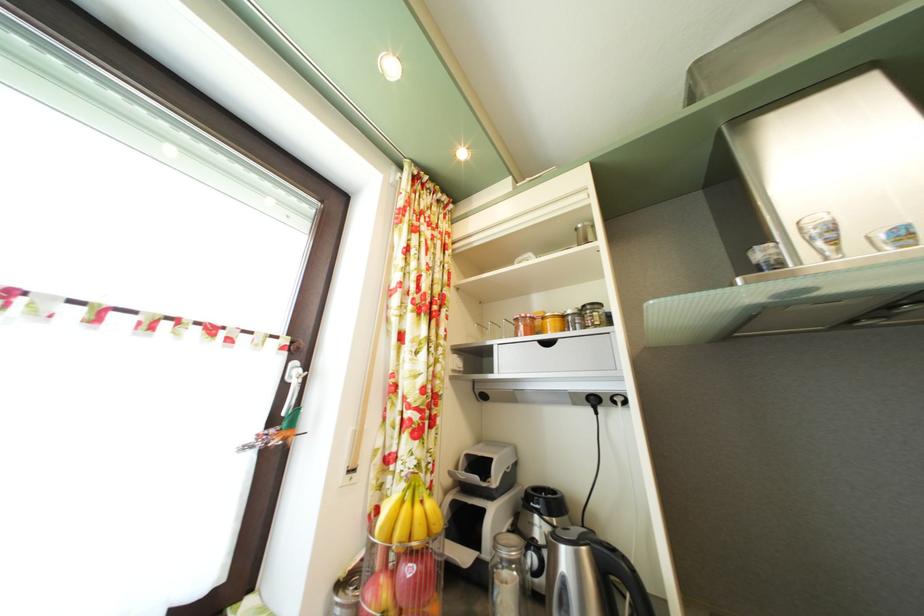
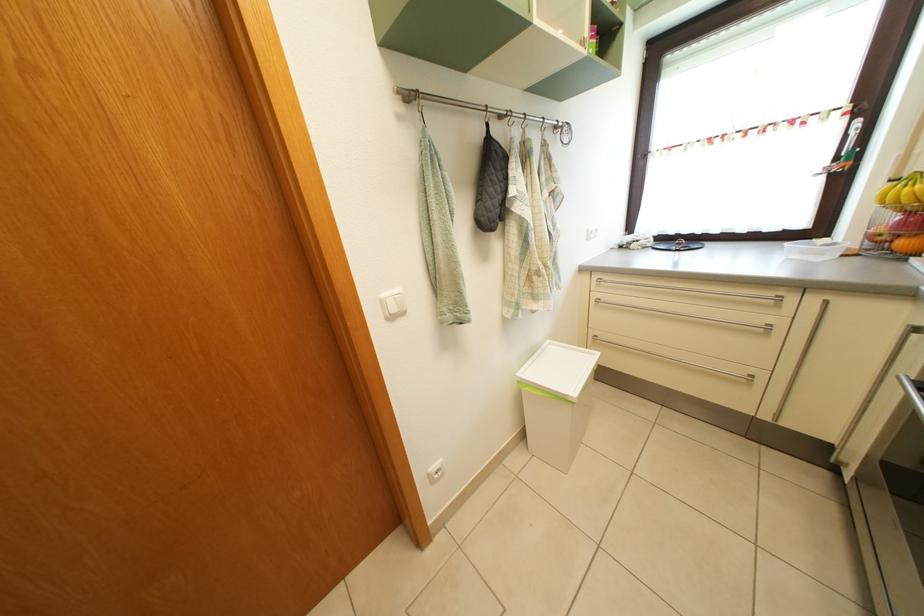
Where in the second image is the point corresponding to (x=292, y=394) from the first image?

(853, 146)